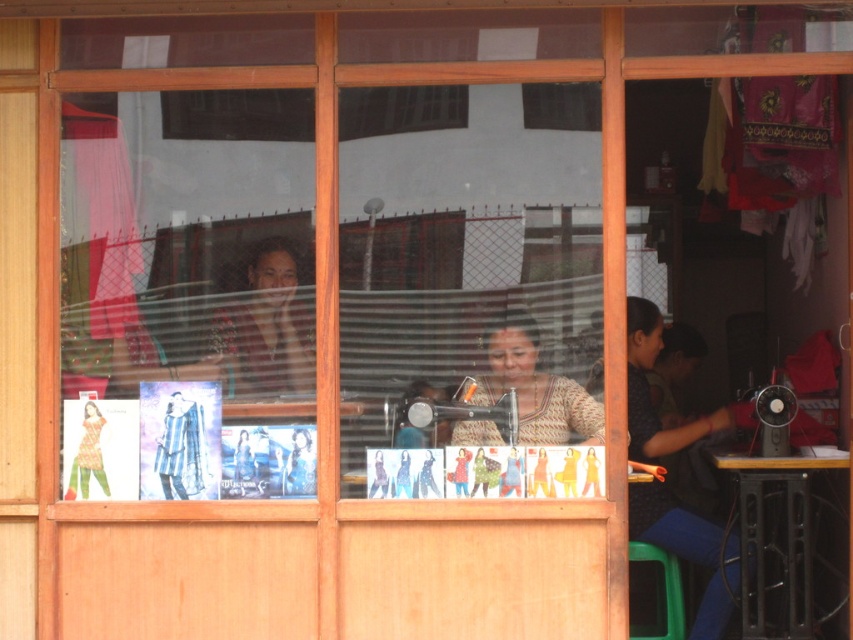
Question: In this image, where is green plastic stool at lower right located relative to printed cotton dress at center?

Choices:
 (A) above
 (B) below

Answer: (B)

Question: Which object appears closest to the camera in this image?

Choices:
 (A) dark blue fabric at lower right
 (B) green plastic stool at lower right
 (C) printed cotton dress at center
 (D) matte brown shirt at center

Answer: (D)

Question: Does matte brown shirt at center appear under knitted beige sweater at center?

Choices:
 (A) yes
 (B) no

Answer: (B)

Question: Among these objects, which one is farthest from the camera?

Choices:
 (A) printed cotton dress at center
 (B) matte brown shirt at center

Answer: (A)

Question: Which object appears closest to the camera in this image?

Choices:
 (A) knitted beige sweater at center
 (B) printed cotton dress at center
 (C) green plastic stool at lower right

Answer: (A)

Question: Does matte brown shirt at center appear over green plastic stool at lower right?

Choices:
 (A) no
 (B) yes

Answer: (B)